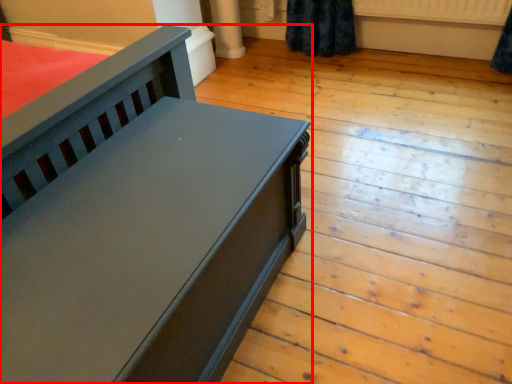
Question: From the image's perspective, where is furniture (annotated by the red box) located relative to radiator?

Choices:
 (A) above
 (B) below

Answer: (B)